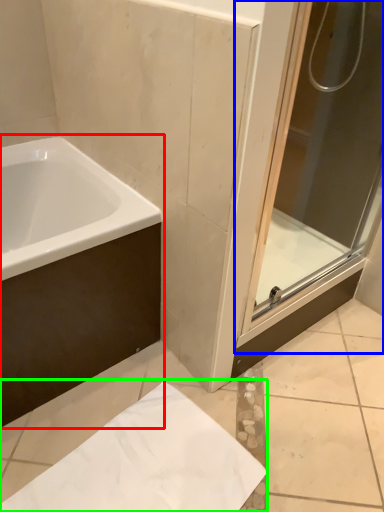
Question: Based on their relative distances, which object is farther from bathtub (highlighted by a red box)? Choose from screen door (highlighted by a blue box) and paper (highlighted by a green box).

Choices:
 (A) screen door
 (B) paper

Answer: (A)